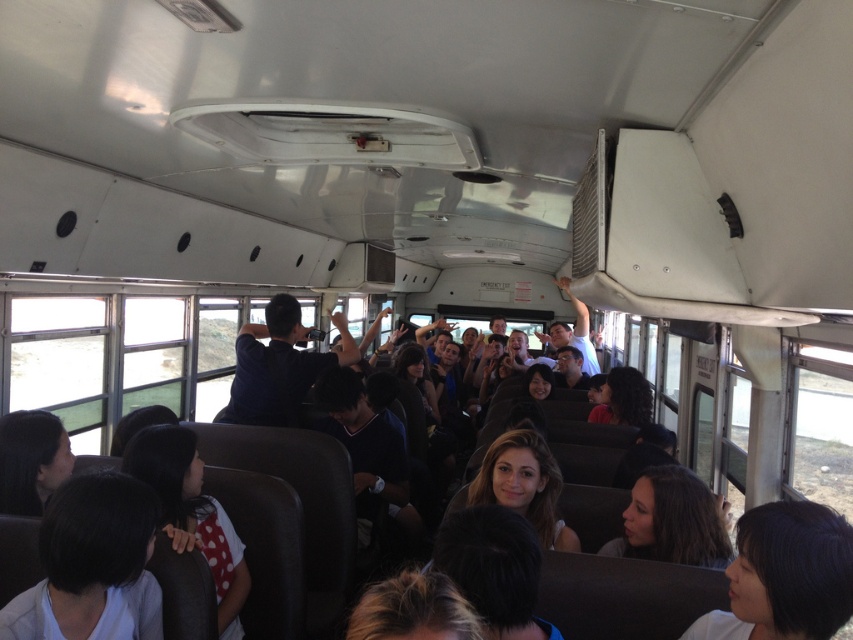
From the picture: Is dark hair at lower right to the right of dark brown hair at center from the viewer's perspective?

In fact, dark hair at lower right is to the left of dark brown hair at center.

Can you confirm if dark hair at lower right is positioned above dark brown hair at center?

Correct, dark hair at lower right is located above dark brown hair at center.

Between point (751, 625) and point (651, 508), which one is positioned in front?

Point (751, 625)

At what (x,y) coordinates should I click in order to perform the action: click on dark hair at lower right. Please return your answer as a coordinate pair (x, y). Looking at the image, I should click on (785, 576).

Is point (41, 621) closer to viewer compared to point (805, 577)?

No, it is not.

In the scene shown: Which is more to the left, dark brown hair at lower left or dark hair at lower right?

From the viewer's perspective, dark brown hair at lower left appears more on the left side.

Does point (13, 634) come behind point (756, 529)?

Yes, point (13, 634) is farther from viewer.

In order to click on dark brown hair at lower left in this screenshot , I will do `click(91, 564)`.

Is dark brown hair at lower left above dark brown hair at center?

Yes.

Based on the photo, does dark brown hair at lower left appear on the right side of dark brown hair at center?

In fact, dark brown hair at lower left is to the left of dark brown hair at center.

Which is behind, point (57, 627) or point (689, 544)?

The point (689, 544) is more distant.

Identify the location of dark brown hair at lower left. (91, 564).